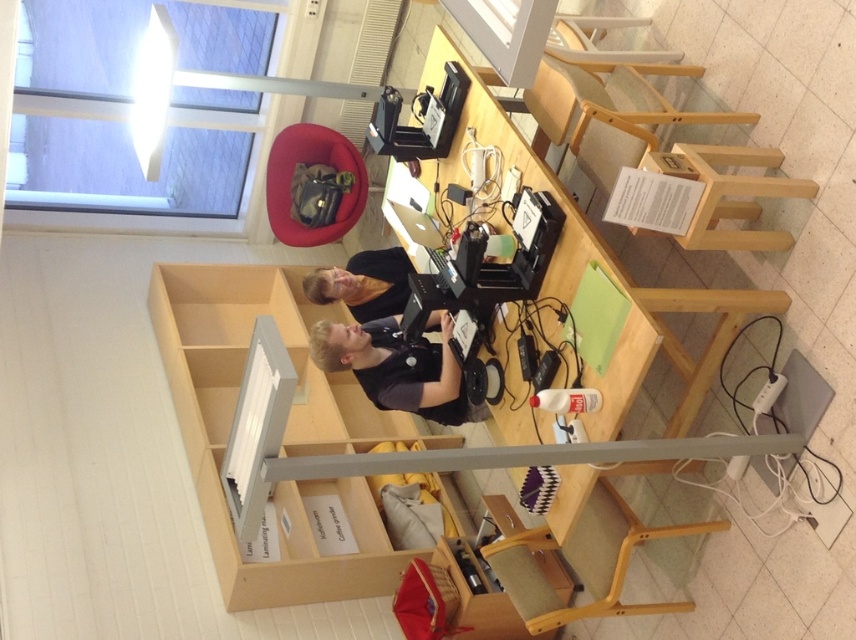
Is the position of dark gray shirt at center more distant than that of matte black shirt at center?

No, dark gray shirt at center is closer to the viewer.

Does dark gray shirt at center appear over matte black shirt at center?

Incorrect, dark gray shirt at center is not positioned above matte black shirt at center.

Where is `dark gray shirt at center`? The image size is (856, 640). dark gray shirt at center is located at coordinates point(395,365).

Image resolution: width=856 pixels, height=640 pixels. What are the coordinates of `dark gray shirt at center` in the screenshot? It's located at (395, 365).